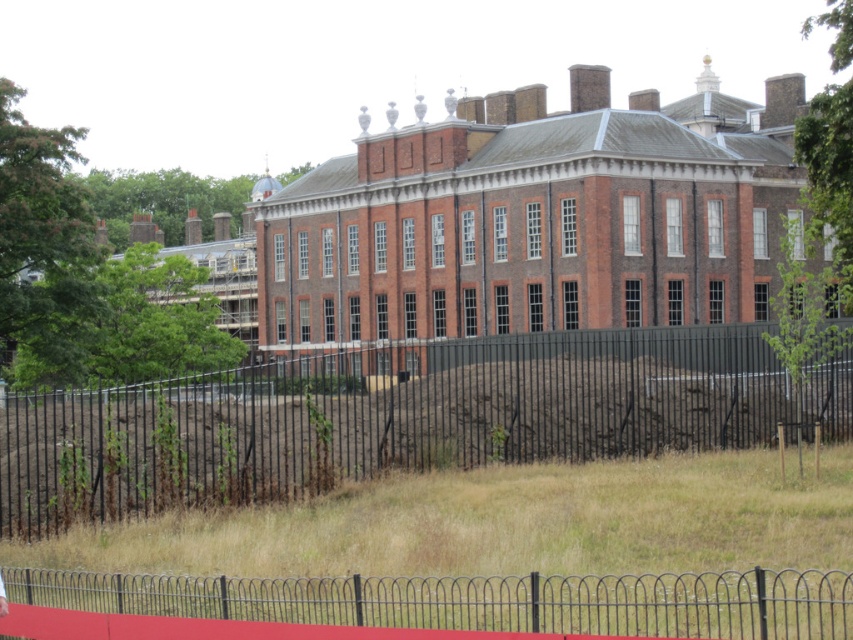
Does point (357, 438) come closer to viewer compared to point (515, 616)?

No, it is not.

Consider the image. Does black metal fence at center appear over metallic wire fence at lower center?

Yes.

Measure the distance between black metal fence at center and camera.

They are 42.36 meters apart.

You are a GUI agent. You are given a task and a screenshot of the screen. Output one action in this format:
    pyautogui.click(x=<x>, y=<y>)
    Task: Click on the black metal fence at center
    Image resolution: width=853 pixels, height=640 pixels.
    Given the screenshot: What is the action you would take?
    pyautogui.click(x=383, y=419)